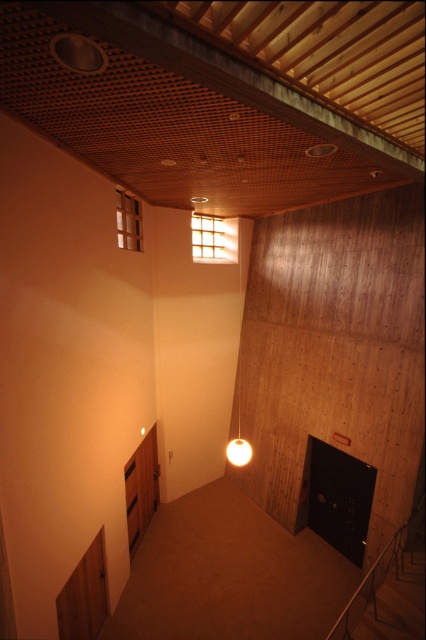
You are a delivery person holding a package that measures 1.5 meters in length. You need to carry it through the hallway and pass between the translucent wooden window at upper center and the clear glass window at upper center. Will the package fit through the space between them?

The distance between the translucent wooden window at upper center and the clear glass window at upper center is 1.60 meters. Since the package is 1.5 meters long, it will fit through the space between them as there is enough clearance.